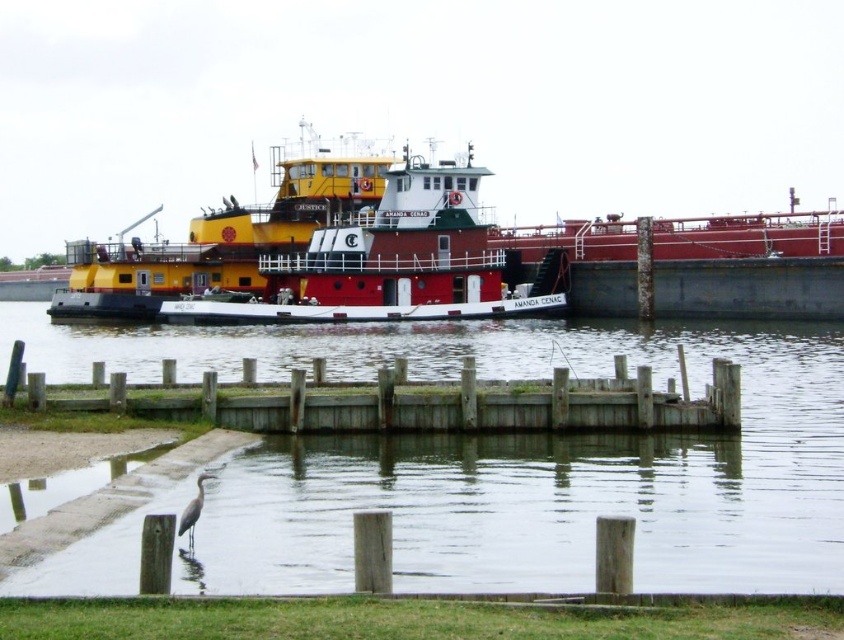
Question: Can you confirm if smooth concrete dock at lower center is positioned below red matte tugboat at center?

Choices:
 (A) no
 (B) yes

Answer: (B)

Question: In this image, where is yellow matte tugboat at upper center located relative to gray matte bird at lower left?

Choices:
 (A) below
 (B) above

Answer: (B)

Question: Which of the following is the closest to the observer?

Choices:
 (A) (203, 384)
 (B) (203, 486)
 (C) (650, 588)

Answer: (C)

Question: Among these objects, which one is nearest to the camera?

Choices:
 (A) gray matte bird at lower left
 (B) yellow matte tugboat at upper center
 (C) smooth concrete dock at lower center
 (D) weathered wood dock at lower center

Answer: (C)

Question: Can you confirm if yellow matte tugboat at upper center is positioned above gray matte bird at lower left?

Choices:
 (A) no
 (B) yes

Answer: (B)

Question: Which object appears closest to the camera in this image?

Choices:
 (A) smooth concrete dock at lower center
 (B) yellow matte tugboat at upper center
 (C) red matte tugboat at center
 (D) gray matte bird at lower left

Answer: (A)